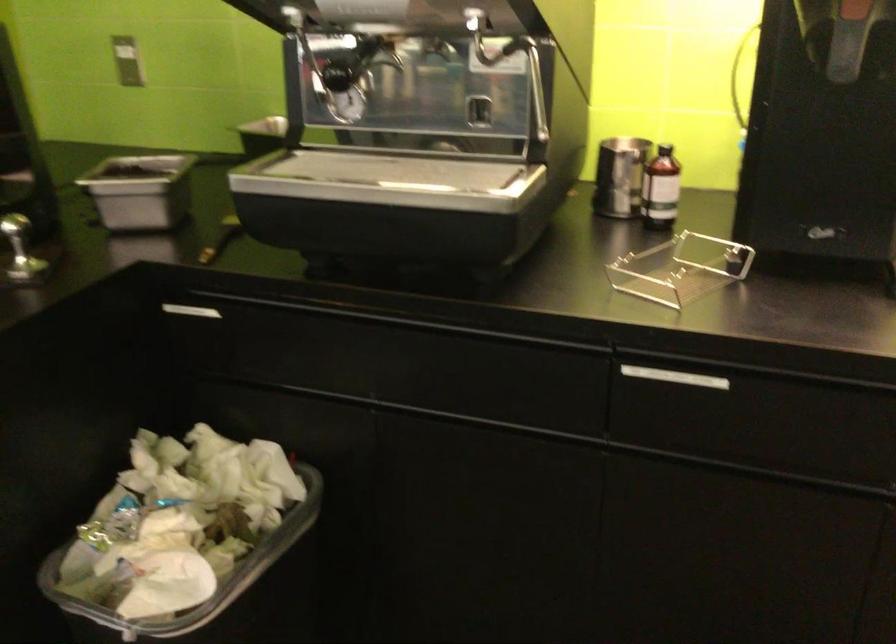
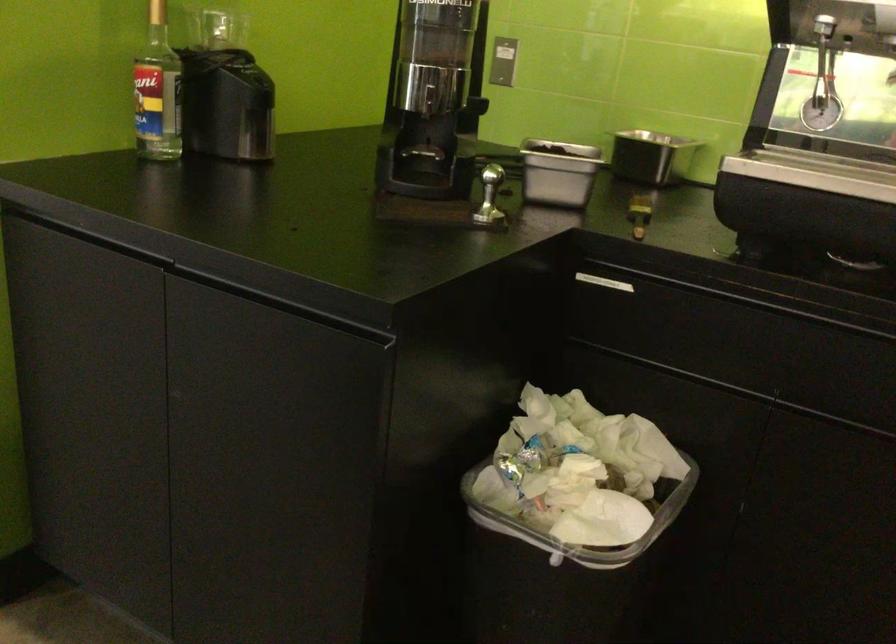
Question: In a continuous first-person perspective shot, in which direction is the camera moving?

Choices:
 (A) Left
 (B) Right
 (C) Forward
 (D) Backward

Answer: (A)